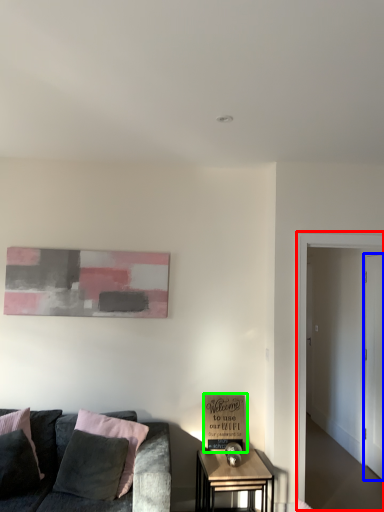
Question: Which object is positioned farthest from glass door (highlighted by a red box)? Select from glass door (highlighted by a blue box) and cardboard box (highlighted by a green box).

Choices:
 (A) glass door
 (B) cardboard box

Answer: (A)